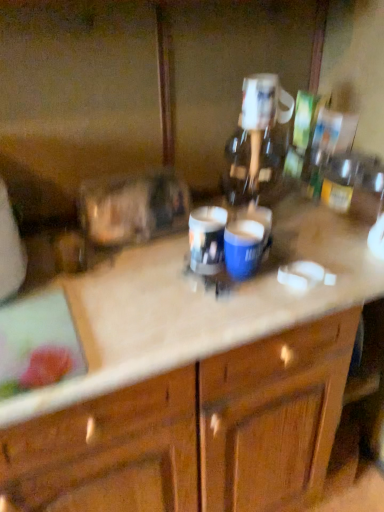
Question: From the image's perspective, is beige marble countertop at center beneath blue glossy mug at center, which is the first beverage in right-to-left order?

Choices:
 (A) no
 (B) yes

Answer: (B)

Question: Could blue glossy mug at center, the 2th beverage from the left, be considered to be inside beige marble countertop at center?

Choices:
 (A) no
 (B) yes

Answer: (A)

Question: Can you confirm if beige marble countertop at center is shorter than blue glossy mug at center, the 2th beverage from the left?

Choices:
 (A) no
 (B) yes

Answer: (A)

Question: Is beige marble countertop at center oriented towards blue glossy mug at center, which is the first beverage in right-to-left order?

Choices:
 (A) no
 (B) yes

Answer: (A)

Question: Is beige marble countertop at center positioned behind blue glossy mug at center, which is the first beverage in right-to-left order?

Choices:
 (A) yes
 (B) no

Answer: (B)

Question: Is beige marble countertop at center inside the boundaries of blue glossy mug at center, the 2th beverage from the left, or outside?

Choices:
 (A) inside
 (B) outside

Answer: (B)

Question: From the image's perspective, is beige marble countertop at center located above or below blue glossy mug at center, the 2th beverage from the left?

Choices:
 (A) below
 (B) above

Answer: (A)

Question: Looking at the image, does beige marble countertop at center seem bigger or smaller compared to blue glossy mug at center, the 2th beverage from the left?

Choices:
 (A) small
 (B) big

Answer: (B)

Question: Is beige marble countertop at center wider or thinner than blue glossy mug at center, the 2th beverage from the left?

Choices:
 (A) wide
 (B) thin

Answer: (A)

Question: From the image's perspective, is blue glossy mug at center, which is the first beverage in right-to-left order, above or below matte plastic cup at center, which is counted as the 1th beverage, starting from the left?

Choices:
 (A) below
 (B) above

Answer: (A)

Question: Is blue glossy mug at center, the 2th beverage from the left, inside the boundaries of matte plastic cup at center, arranged as the second beverage when viewed from the right, or outside?

Choices:
 (A) outside
 (B) inside

Answer: (A)

Question: From a real-world perspective, is blue glossy mug at center, which is the first beverage in right-to-left order, positioned above or below matte plastic cup at center, which is counted as the 1th beverage, starting from the left?

Choices:
 (A) below
 (B) above

Answer: (A)

Question: Looking at the image, does blue glossy mug at center, the 2th beverage from the left, seem bigger or smaller compared to matte plastic cup at center, which is counted as the 1th beverage, starting from the left?

Choices:
 (A) big
 (B) small

Answer: (B)

Question: From a real-world perspective, relative to matte plastic cup at center, arranged as the second beverage when viewed from the right, is beige marble countertop at center vertically above or below?

Choices:
 (A) below
 (B) above

Answer: (A)

Question: From the image's perspective, relative to matte plastic cup at center, arranged as the second beverage when viewed from the right, is beige marble countertop at center above or below?

Choices:
 (A) above
 (B) below

Answer: (B)